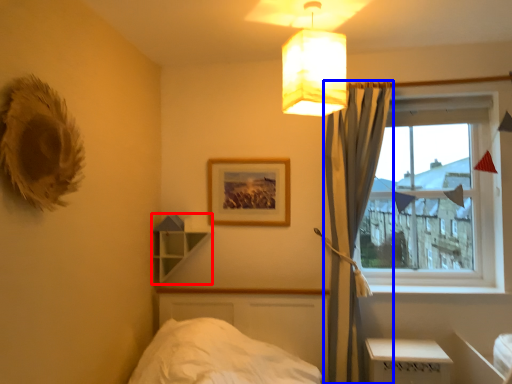
Question: Which object appears farthest to the camera in this image, shelf (highlighted by a red box) or curtain (highlighted by a blue box)?

Choices:
 (A) shelf
 (B) curtain

Answer: (A)